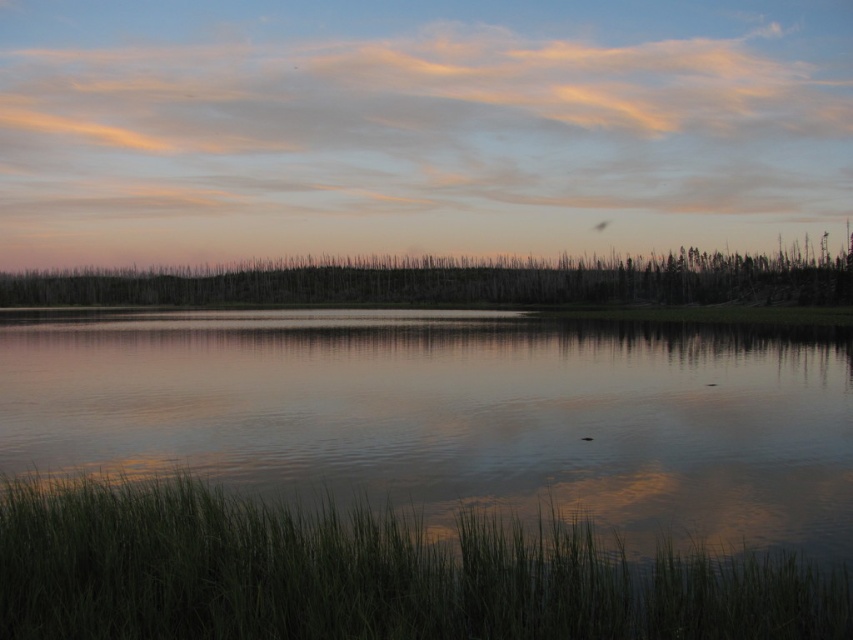
Question: Considering the relative positions of transparent water at center and pastel cotton clouds at upper center in the image provided, where is transparent water at center located with respect to pastel cotton clouds at upper center?

Choices:
 (A) above
 (B) below

Answer: (B)

Question: Which object appears closest to the camera in this image?

Choices:
 (A) silhouetted dead trees at center
 (B) transparent water at center

Answer: (B)

Question: In this image, where is transparent water at center located relative to silhouetted dead trees at center?

Choices:
 (A) right
 (B) left

Answer: (A)

Question: Does transparent water at center appear under silhouetted dead trees at center?

Choices:
 (A) no
 (B) yes

Answer: (B)

Question: Among these points, which one is nearest to the camera?

Choices:
 (A) (42, 374)
 (B) (666, 257)
 (C) (248, 172)

Answer: (A)

Question: Among these objects, which one is nearest to the camera?

Choices:
 (A) transparent water at center
 (B) silhouetted dead trees at center
 (C) pastel cotton clouds at upper center

Answer: (A)